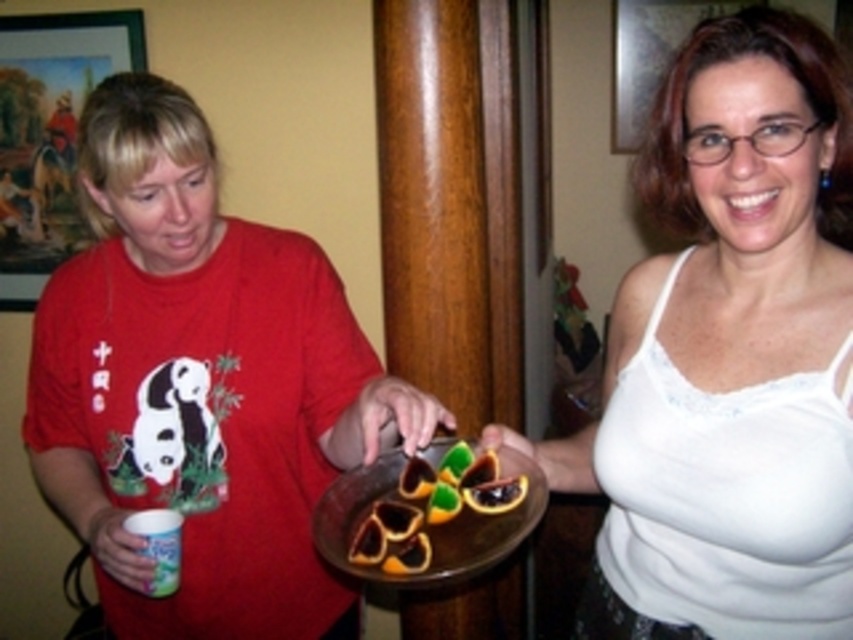
You are a fashion designer observing two outfits in the image. The matte red shirt at left and the white fabric tank top at center. Which one is taller in the image?

The matte red shirt at left has a greater height compared to the white fabric tank top at center.